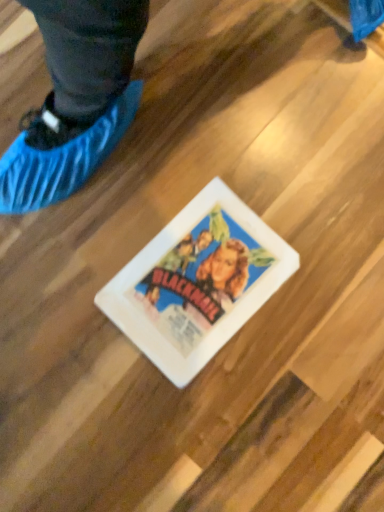
The height and width of the screenshot is (512, 384). Find the location of `blank space above white glossy book cover at center (from a real-world perspective)`. blank space above white glossy book cover at center (from a real-world perspective) is located at coordinates (196, 282).